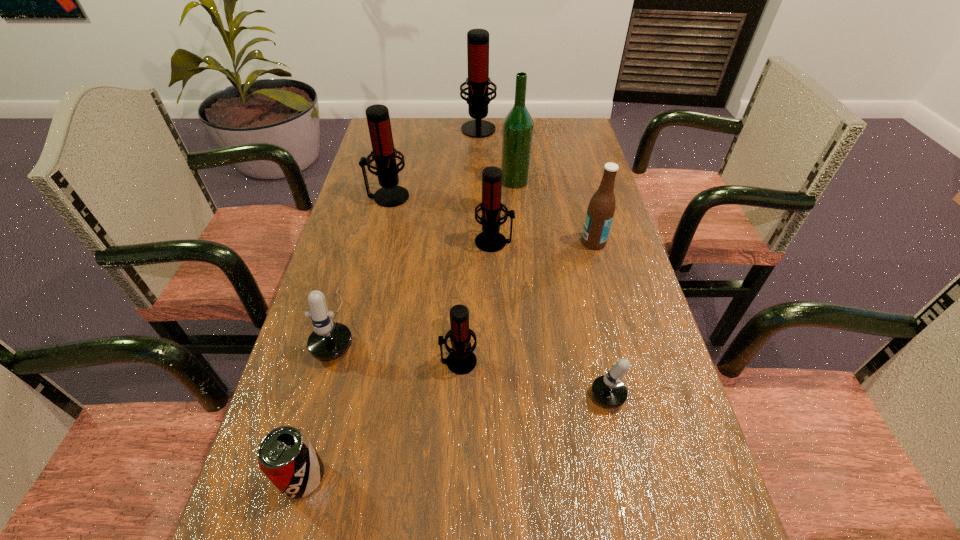
You are a GUI agent. You are given a task and a screenshot of the screen. Output one action in this format:
    pyautogui.click(x=<x>, y=<y>)
    Task: Click on the vacant space at the far right corner of the desktop
    The width and height of the screenshot is (960, 540).
    Given the screenshot: What is the action you would take?
    pyautogui.click(x=586, y=129)

The width and height of the screenshot is (960, 540). What are the coordinates of `vacant space that is in between the second nearest red microphone and the smallest red microphone` in the screenshot? It's located at (476, 302).

Find the location of a particular element. The image size is (960, 540). free spot between the fifth nearest microphone and the farthest object is located at coordinates (433, 162).

Image resolution: width=960 pixels, height=540 pixels. I want to click on empty space that is in between the fifth shortest microphone and the nearest red microphone, so click(423, 279).

The image size is (960, 540). What are the coordinates of `vacant region between the beer bottle and the farther white microphone` in the screenshot? It's located at pos(467,283).

Find the location of a particular element. free point between the third farthest microphone and the soda can is located at coordinates (398, 359).

The width and height of the screenshot is (960, 540). I want to click on free area in between the nearest red microphone and the second farthest microphone, so click(x=423, y=279).

Select which object is the closest to the second tallest microphone. Please provide its 2D coordinates. Your answer should be formatted as a tuple, i.e. [(x, y)], where the tuple contains the x and y coordinates of a point satisfying the conditions above.

[(490, 240)]

Point out which object is positioned as the eighth nearest to the bigger white microphone. Please provide its 2D coordinates. Your answer should be formatted as a tuple, i.e. [(x, y)], where the tuple contains the x and y coordinates of a point satisfying the conditions above.

[(478, 81)]

This screenshot has height=540, width=960. In order to click on microphone object that ranks as the sixth closest to the nearest object in this screenshot , I will do `click(478, 81)`.